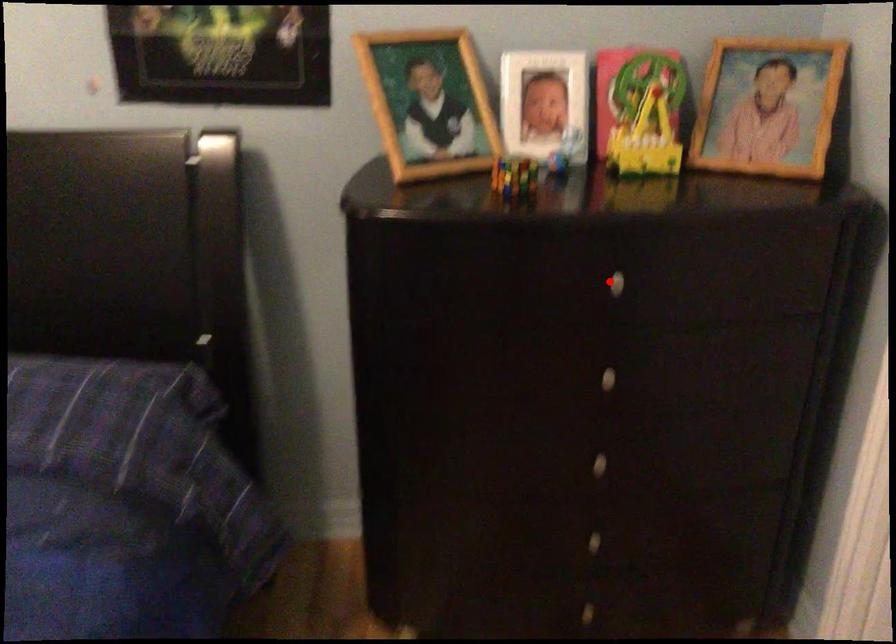
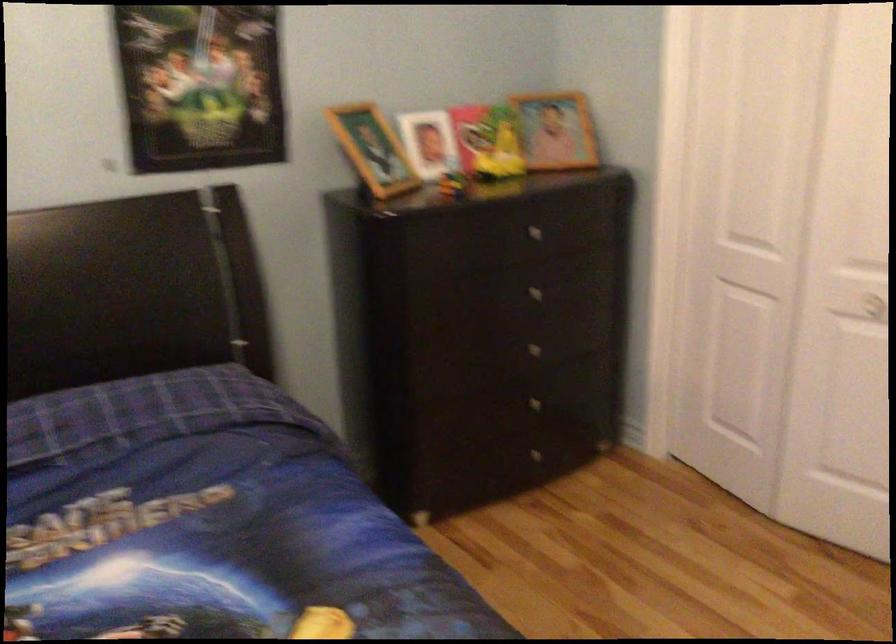
Question: I am providing you with two images of the same scene from different viewpoints. Given a red point in image1, look at the same physical point in image2. Is it:

Choices:
 (A) Closer to the viewpoint
 (B) Farther from the viewpoint

Answer: (B)